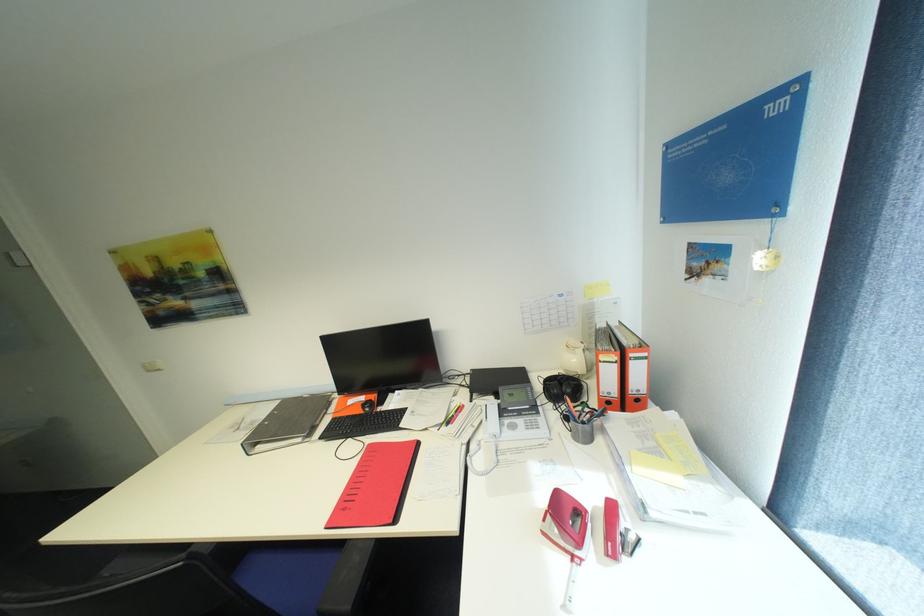
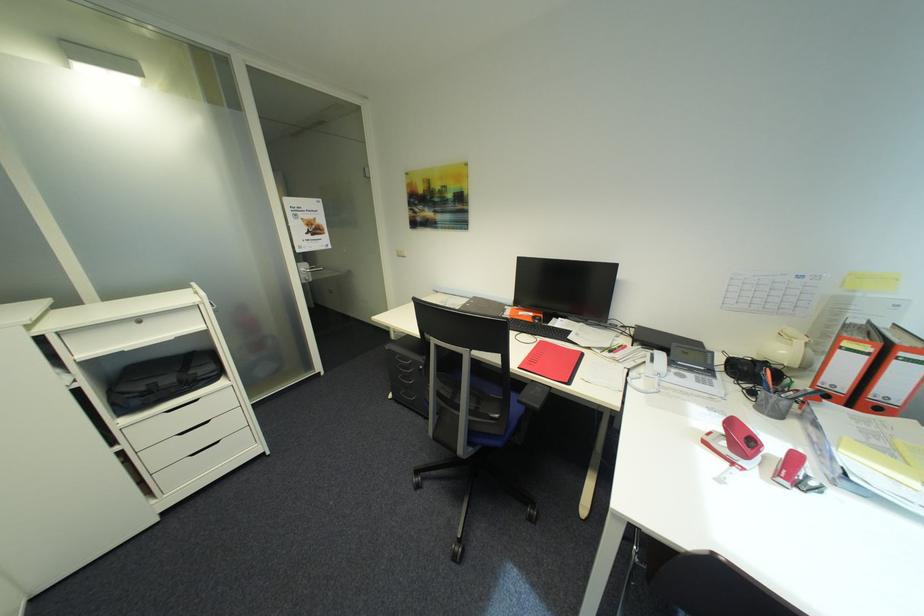
Locate, in the second image, the point that corresponds to the point at 580,557 in the first image.

(742, 464)